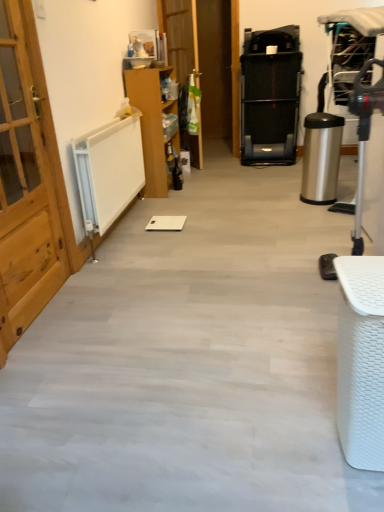
Question: Is point (11, 240) positioned closer to the camera than point (375, 407)?

Choices:
 (A) farther
 (B) closer

Answer: (A)

Question: From the image's perspective, is light wood door at left, the second door when ordered from top to bottom, above or below white woven basket at lower right, the 2th furniture viewed from the back?

Choices:
 (A) above
 (B) below

Answer: (A)

Question: Which is nearer to the wooden door at center, which is the 1th door from top to bottom?

Choices:
 (A) light wood door at left, the second door when ordered from top to bottom
 (B) white woven basket at lower right, the 2th furniture in the top-to-bottom sequence
 (C) wooden cabinet at center, which is the first furniture from back to front

Answer: (C)

Question: Which of these objects is positioned closest to the white woven basket at lower right, the first furniture when ordered from bottom to top?

Choices:
 (A) light wood door at left, which is the first door in front-to-back order
 (B) wooden cabinet at center, which is counted as the second furniture, starting from the bottom
 (C) wooden door at center, the 2th door when ordered from front to back

Answer: (A)